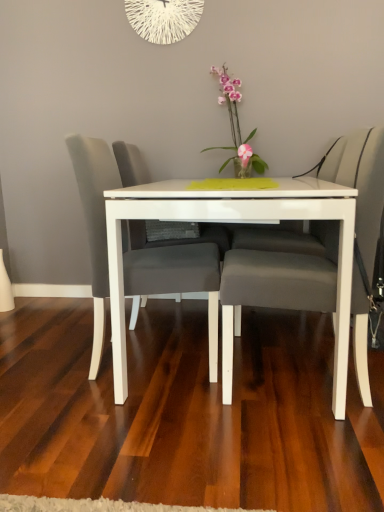
Question: Is white string clock at upper center touching pink glossy orchid at center?

Choices:
 (A) no
 (B) yes

Answer: (A)

Question: From the image's perspective, is white string clock at upper center located beneath pink glossy orchid at center?

Choices:
 (A) no
 (B) yes

Answer: (A)

Question: Does white string clock at upper center have a lesser height compared to pink glossy orchid at center?

Choices:
 (A) yes
 (B) no

Answer: (A)

Question: From a real-world perspective, does white string clock at upper center sit lower than pink glossy orchid at center?

Choices:
 (A) yes
 (B) no

Answer: (B)

Question: Does white string clock at upper center have a larger size compared to pink glossy orchid at center?

Choices:
 (A) no
 (B) yes

Answer: (A)

Question: Considering the relative sizes of white string clock at upper center and pink glossy orchid at center in the image provided, is white string clock at upper center smaller than pink glossy orchid at center?

Choices:
 (A) yes
 (B) no

Answer: (A)

Question: Is the position of pink glossy orchid at center less distant than that of white string clock at upper center?

Choices:
 (A) no
 (B) yes

Answer: (B)

Question: Does pink glossy orchid at center have a larger size compared to white string clock at upper center?

Choices:
 (A) yes
 (B) no

Answer: (A)

Question: Is pink glossy orchid at center taller than white string clock at upper center?

Choices:
 (A) no
 (B) yes

Answer: (B)

Question: Is pink glossy orchid at center at the left side of white string clock at upper center?

Choices:
 (A) yes
 (B) no

Answer: (B)

Question: Is pink glossy orchid at center positioned with its back to white string clock at upper center?

Choices:
 (A) no
 (B) yes

Answer: (A)

Question: Could you tell me if pink glossy orchid at center is turned towards white string clock at upper center?

Choices:
 (A) no
 (B) yes

Answer: (A)

Question: Is the depth of matte gray cushioned chair at center, the 1th chair from the right, greater than that of matte gray chair at center, the first chair positioned from the left?

Choices:
 (A) no
 (B) yes

Answer: (A)